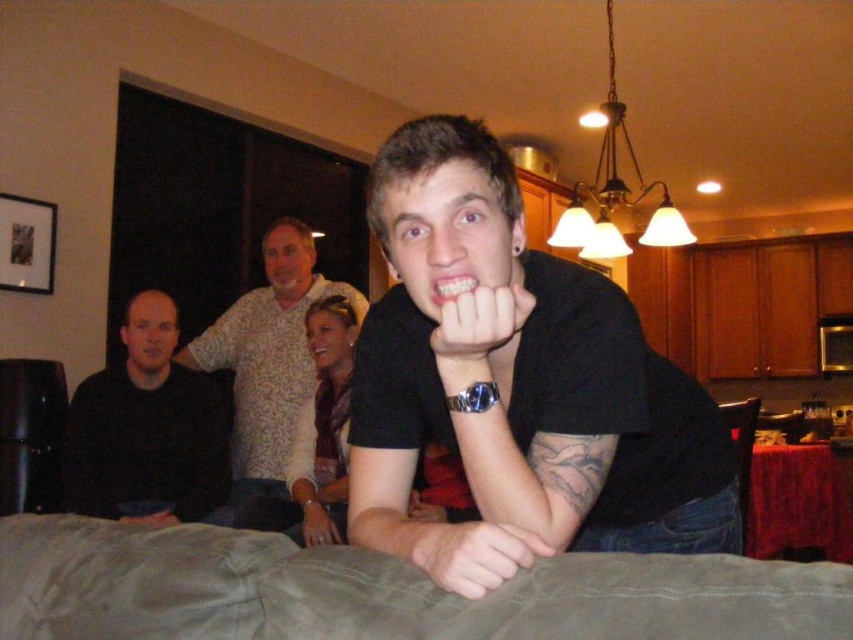
From the picture: Who is lower down, suede-like brown bed at lower center or white matte hand at center?

Positioned lower is suede-like brown bed at lower center.

Which is more to the right, suede-like brown bed at lower center or white matte hand at center?

white matte hand at center is more to the right.

The width and height of the screenshot is (853, 640). In order to click on suede-like brown bed at lower center in this screenshot , I will do [x=383, y=592].

Is point (146, 616) closer to viewer compared to point (321, 403)?

That is True.

Is suede-like brown bed at lower center above white leather bracelet at lower center?

Indeed, suede-like brown bed at lower center is positioned over white leather bracelet at lower center.

Is point (181, 636) more distant than point (296, 436)?

That is False.

Find the location of a particular element. The image size is (853, 640). suede-like brown bed at lower center is located at coordinates (383, 592).

Between point (566, 307) and point (415, 499), which one is positioned behind?

The point (415, 499) is more distant.

Which is in front, point (601, 522) or point (410, 509)?

Point (601, 522) is more forward.

Where is `black matte shirt at center`? This screenshot has height=640, width=853. black matte shirt at center is located at coordinates (517, 387).

Identify the location of black matte shirt at center. point(517,387).